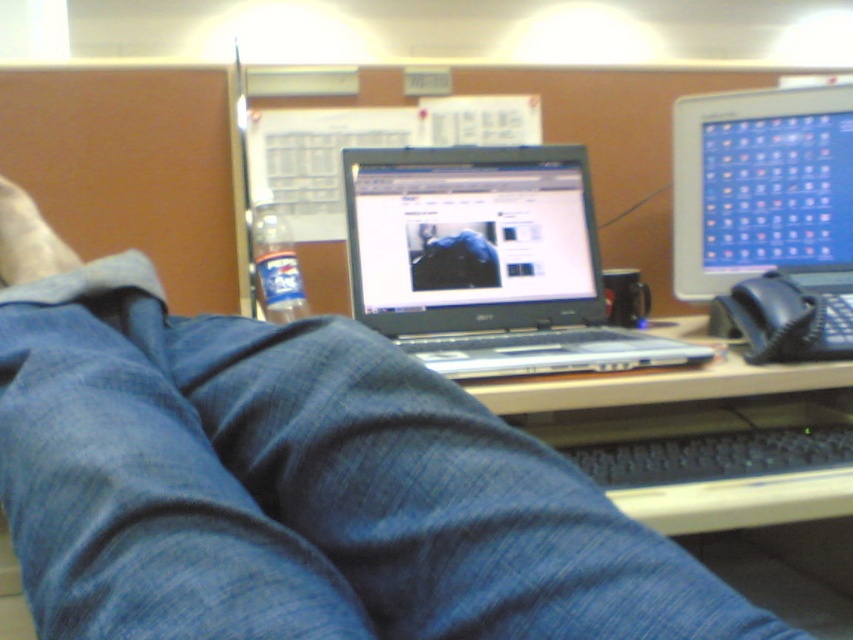
The width and height of the screenshot is (853, 640). Describe the element at coordinates (300, 488) in the screenshot. I see `denim pants at lower center` at that location.

Who is more distant from viewer, (135, 472) or (558, 275)?

Point (558, 275)

Is point (241, 384) less distant than point (399, 275)?

Yes, it is in front of point (399, 275).

At what (x,y) coordinates should I click in order to perform the action: click on denim pants at lower center. Please return your answer as a coordinate pair (x, y). The height and width of the screenshot is (640, 853). Looking at the image, I should click on (300, 488).

Does matte plastic monitor at upper right appear under white fabric foot at lower left?

Actually, matte plastic monitor at upper right is above white fabric foot at lower left.

Identify the location of matte plastic monitor at upper right. The width and height of the screenshot is (853, 640). (766, 218).

Where is `matte plastic monitor at upper right`? matte plastic monitor at upper right is located at coordinates (766, 218).

Describe the element at coordinates (300, 488) in the screenshot. I see `denim pants at lower center` at that location.

Who is shorter, denim pants at lower center or white fabric foot at lower left?

With less height is white fabric foot at lower left.

Describe the element at coordinates (300, 488) in the screenshot. This screenshot has height=640, width=853. I see `denim pants at lower center` at that location.

At what (x,y) coordinates should I click in order to perform the action: click on denim pants at lower center. Please return your answer as a coordinate pair (x, y). This screenshot has width=853, height=640. Looking at the image, I should click on click(300, 488).